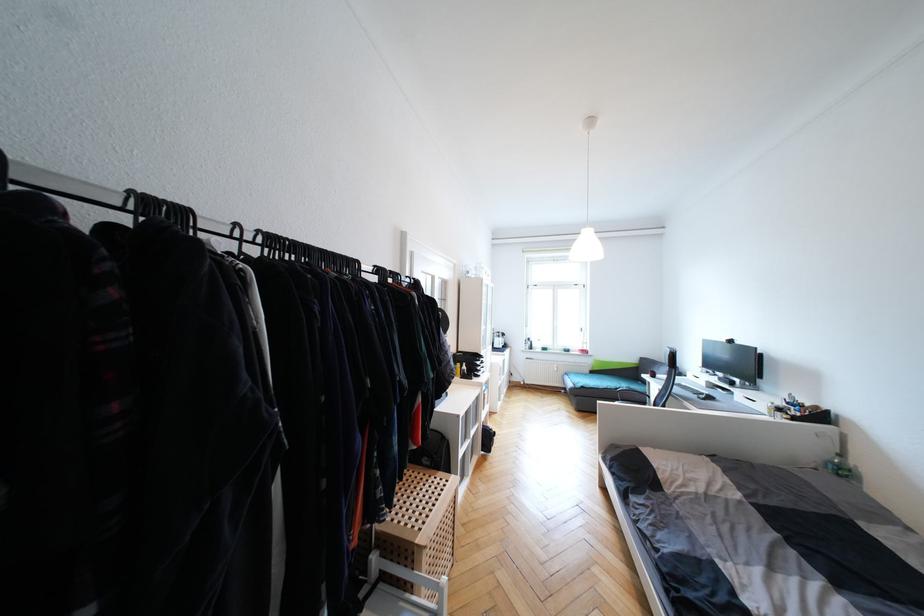
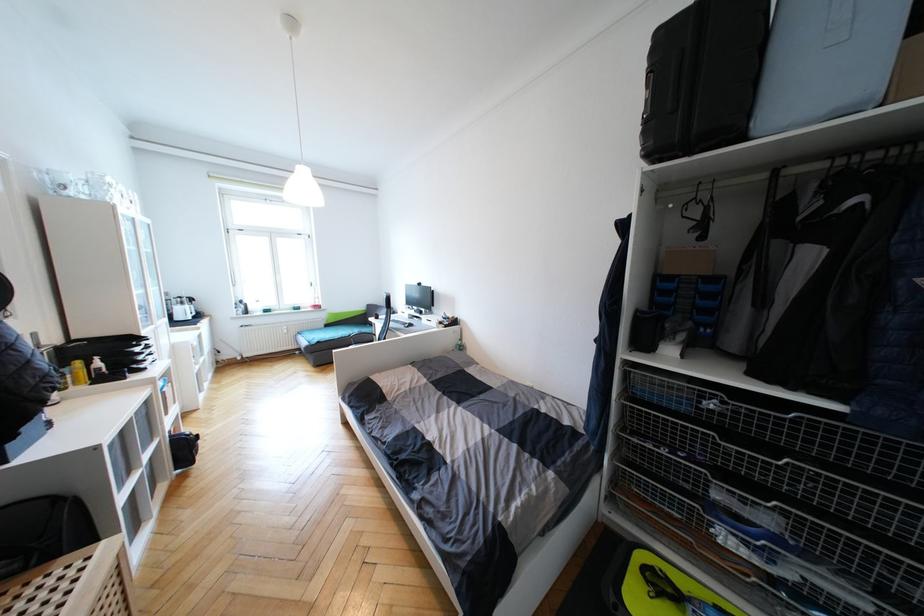
In the second image, find the point that corresponds to point (596, 373) in the first image.

(331, 326)